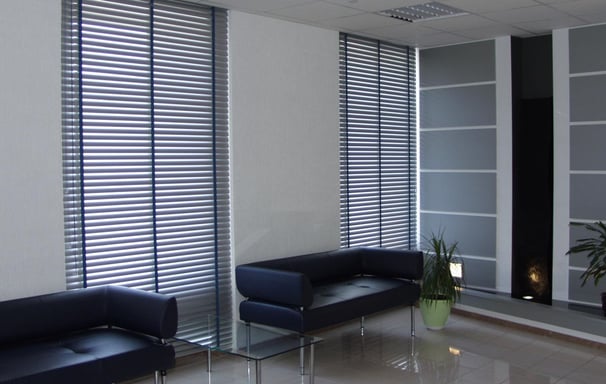
This screenshot has width=606, height=384. Identify the location of planter. (441, 310).